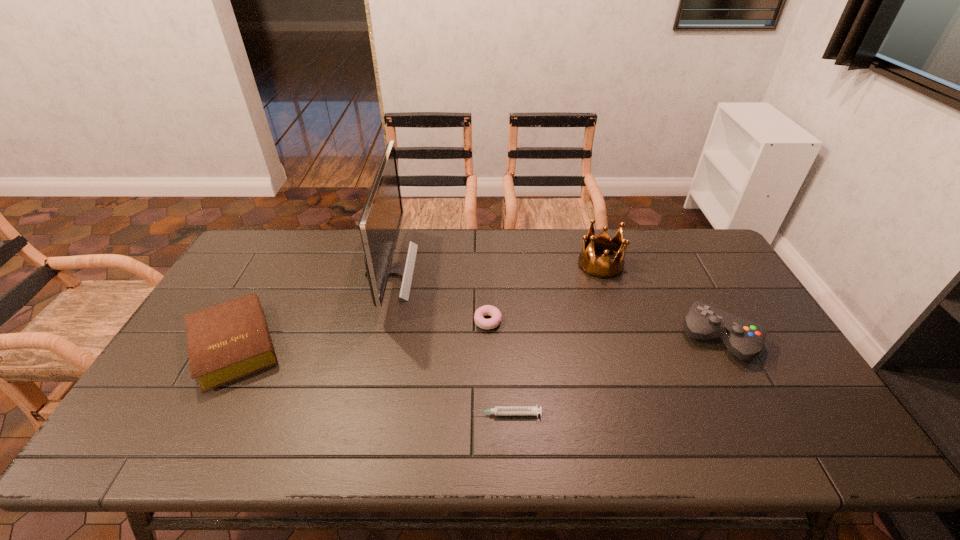
The width and height of the screenshot is (960, 540). I want to click on vacant region that satisfies the following two spatial constraints: 1. on the screen side of the second shortest object; 2. on the right side of the fifth object from right to left, so click(378, 321).